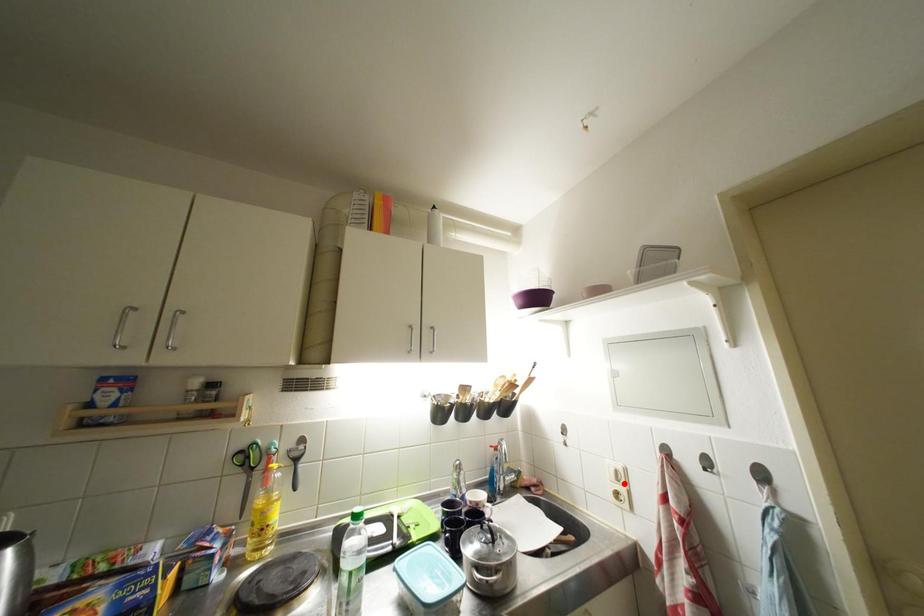
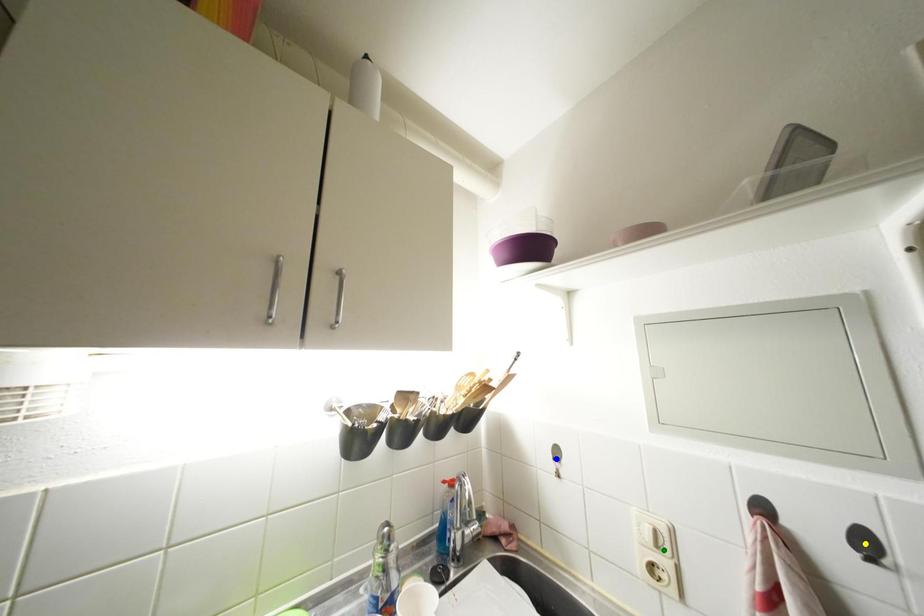
Question: I am providing you with two images of the same scene from different viewpoints. A red point is marked on the first image. You are given multiple points on the second image. Which point in image 2 is actually the same real-world point as the red point in image 1?

Choices:
 (A) yellow point
 (B) green point
 (C) blue point

Answer: (B)